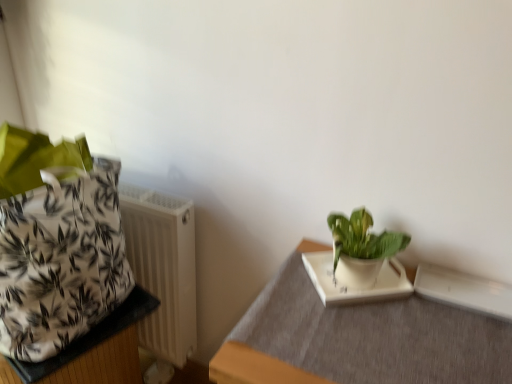
Locate an element on the screen. Image resolution: width=512 pixels, height=384 pixels. free spot to the left of green glossy plant at upper right is located at coordinates (293, 290).